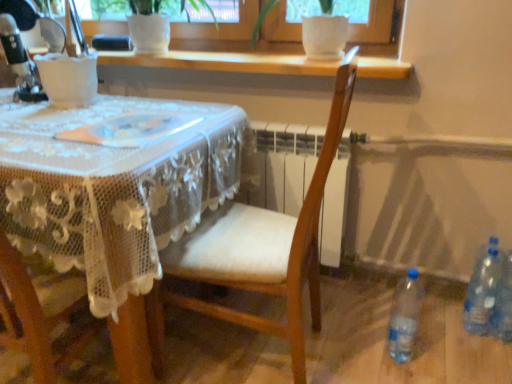
Question: Is wooden chair at center oriented away from clear plastic bottle at lower right, placed as the 1th bottle when sorted from right to left?

Choices:
 (A) no
 (B) yes

Answer: (B)

Question: Is wooden chair at center at the right side of clear plastic bottle at lower right, placed as the 1th bottle when sorted from right to left?

Choices:
 (A) yes
 (B) no

Answer: (B)

Question: Is wooden chair at center positioned before clear plastic bottle at lower right, placed as the 1th bottle when sorted from right to left?

Choices:
 (A) yes
 (B) no

Answer: (A)

Question: Can we say wooden chair at center lies outside clear plastic bottle at lower right, placed as the 1th bottle when sorted from right to left?

Choices:
 (A) no
 (B) yes

Answer: (B)

Question: Can clear plastic bottle at lower right, the third bottle when ordered from left to right, be found inside wooden chair at center?

Choices:
 (A) yes
 (B) no

Answer: (B)

Question: Can you confirm if wooden chair at center is bigger than clear plastic bottle at lower right, placed as the 1th bottle when sorted from right to left?

Choices:
 (A) no
 (B) yes

Answer: (B)

Question: Considering the relative positions of clear plastic bottle at lower right, the second bottle viewed from the left, and clear plastic bottle at lower right, placed as the 1th bottle when sorted from right to left, in the image provided, is clear plastic bottle at lower right, the second bottle viewed from the left, behind clear plastic bottle at lower right, placed as the 1th bottle when sorted from right to left,?

Choices:
 (A) yes
 (B) no

Answer: (A)

Question: Considering the relative positions of clear plastic bottle at lower right, the second bottle viewed from the left, and clear plastic bottle at lower right, the third bottle when ordered from left to right, in the image provided, is clear plastic bottle at lower right, the second bottle viewed from the left, to the right of clear plastic bottle at lower right, the third bottle when ordered from left to right, from the viewer's perspective?

Choices:
 (A) yes
 (B) no

Answer: (B)

Question: From the image's perspective, does clear plastic bottle at lower right, the second bottle viewed from the left, appear higher than clear plastic bottle at lower right, placed as the 1th bottle when sorted from right to left?

Choices:
 (A) no
 (B) yes

Answer: (B)

Question: Can you confirm if clear plastic bottle at lower right, the second bottle viewed from the left, is taller than clear plastic bottle at lower right, placed as the 1th bottle when sorted from right to left?

Choices:
 (A) no
 (B) yes

Answer: (A)

Question: From the image's perspective, is clear plastic bottle at lower right, the second bottle viewed from the left, under clear plastic bottle at lower right, placed as the 1th bottle when sorted from right to left?

Choices:
 (A) yes
 (B) no

Answer: (B)

Question: Are clear plastic bottle at lower right, the second bottle viewed from the left, and clear plastic bottle at lower right, the third bottle when ordered from left to right, located far from each other?

Choices:
 (A) yes
 (B) no

Answer: (B)

Question: Is white lace tablecloth at center positioned far away from clear plastic bottle at lower right, placed as the 1th bottle when sorted from right to left?

Choices:
 (A) no
 (B) yes

Answer: (B)